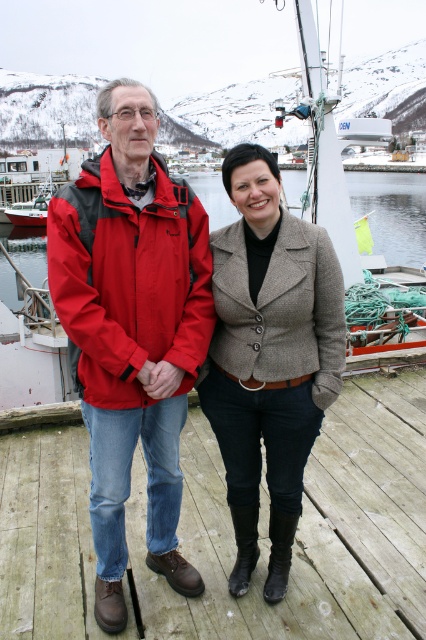
Question: Can you confirm if red matte jacket at left is thinner than textured beige blazer at center?

Choices:
 (A) no
 (B) yes

Answer: (A)

Question: Which point is farther to the camera?

Choices:
 (A) wooden boat at left
 (B) wooden at center
 (C) textured beige blazer at center

Answer: (A)

Question: Estimate the real-world distances between objects in this image. Which object is farther from the wooden boat at left?

Choices:
 (A) textured beige blazer at center
 (B) wooden at center

Answer: (B)

Question: Is wooden at center to the right of red matte jacket at left from the viewer's perspective?

Choices:
 (A) yes
 (B) no

Answer: (B)

Question: Which point appears farthest from the camera in this image?

Choices:
 (A) (39, 204)
 (B) (278, 202)

Answer: (A)

Question: Where is red matte jacket at left located in relation to textured beige blazer at center in the image?

Choices:
 (A) above
 (B) below

Answer: (A)